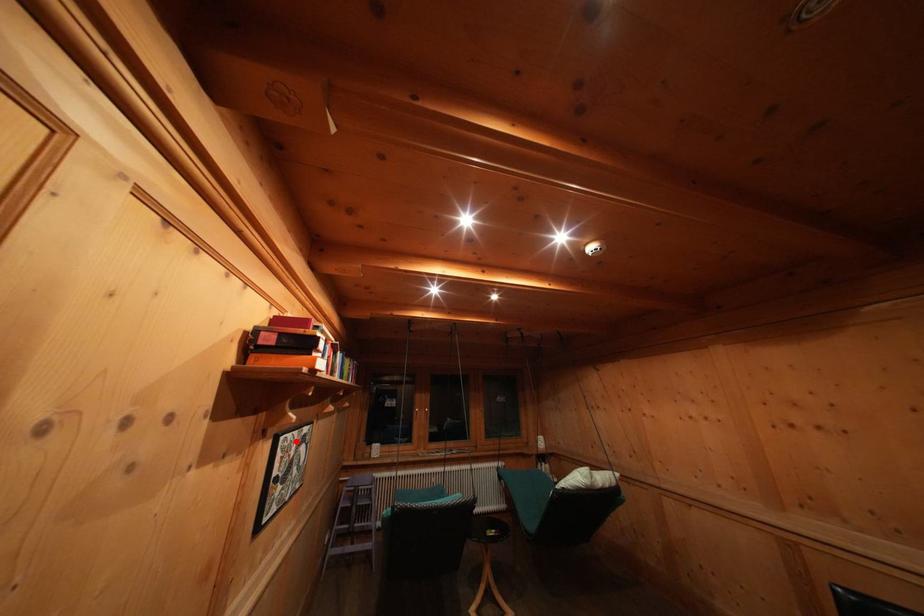
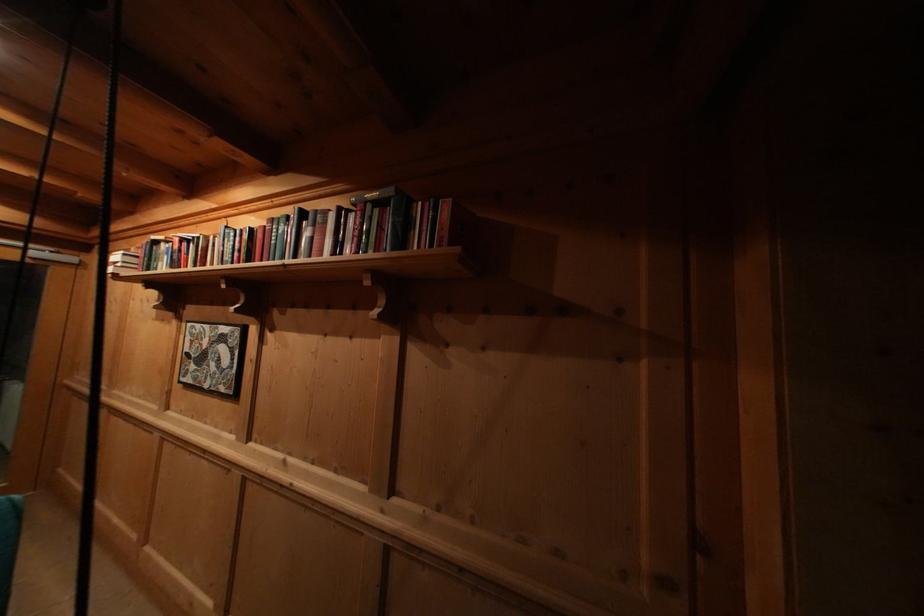
Where in the second image is the point corresponding to the highlighted location from the first image?

(204, 331)